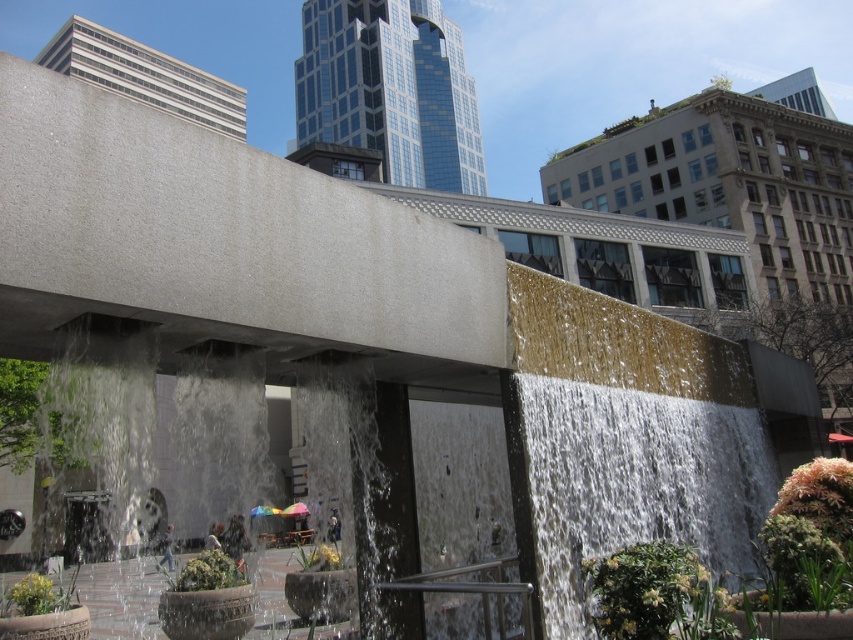
Question: Which point is farther from the camera taking this photo?

Choices:
 (A) (666, 378)
 (B) (584, 301)

Answer: (A)

Question: Can you confirm if gold textured wall at center is smaller than smooth concrete waterfall at center?

Choices:
 (A) yes
 (B) no

Answer: (B)

Question: Does gold textured wall at center appear over smooth concrete waterfall at center?

Choices:
 (A) yes
 (B) no

Answer: (B)

Question: Considering the relative positions of gold textured wall at center and smooth concrete waterfall at center in the image provided, where is gold textured wall at center located with respect to smooth concrete waterfall at center?

Choices:
 (A) left
 (B) right

Answer: (A)